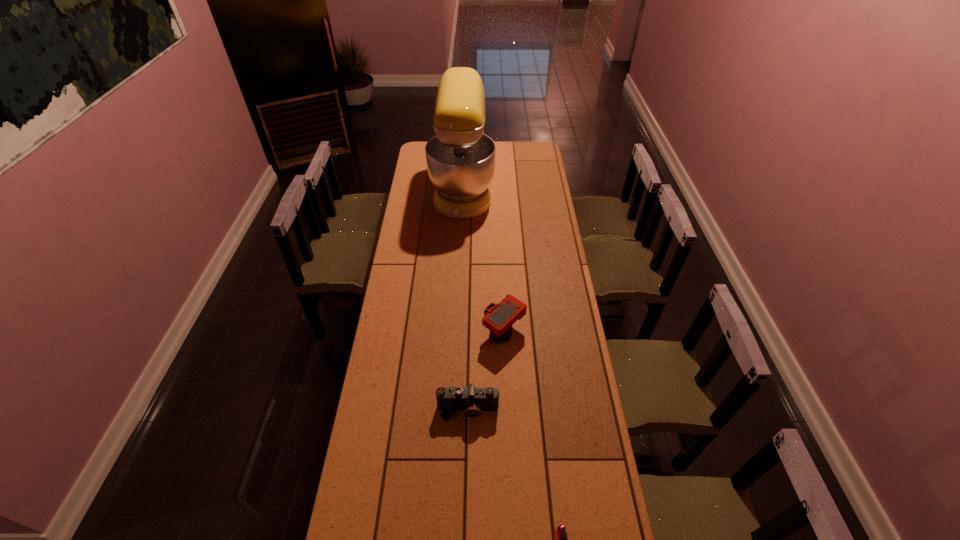
Locate an element on the screen. The width and height of the screenshot is (960, 540). mixer is located at coordinates (460, 158).

You are a GUI agent. You are given a task and a screenshot of the screen. Output one action in this format:
    pyautogui.click(x=<x>, y=<y>)
    Task: Click on the tallest object
    The image size is (960, 540).
    Given the screenshot: What is the action you would take?
    pyautogui.click(x=460, y=158)

The width and height of the screenshot is (960, 540). I want to click on the second farthest object, so click(499, 318).

Locate an element on the screen. The width and height of the screenshot is (960, 540). the farthest camera is located at coordinates (499, 318).

This screenshot has height=540, width=960. Identify the location of the second nearest camera. (473, 400).

The height and width of the screenshot is (540, 960). Find the location of `vacant space situated 0.280m on the side of the mixer with the control knob`. vacant space situated 0.280m on the side of the mixer with the control knob is located at coordinates (543, 188).

Locate an element on the screen. blank space located on the front of the tallest camera is located at coordinates (507, 411).

The height and width of the screenshot is (540, 960). In order to click on free spot located on the front-facing side of the second farthest camera in this screenshot , I will do `click(467, 460)`.

Where is `object that is at the far edge`? The height and width of the screenshot is (540, 960). object that is at the far edge is located at coordinates (460, 158).

I want to click on object present at the left edge, so click(460, 158).